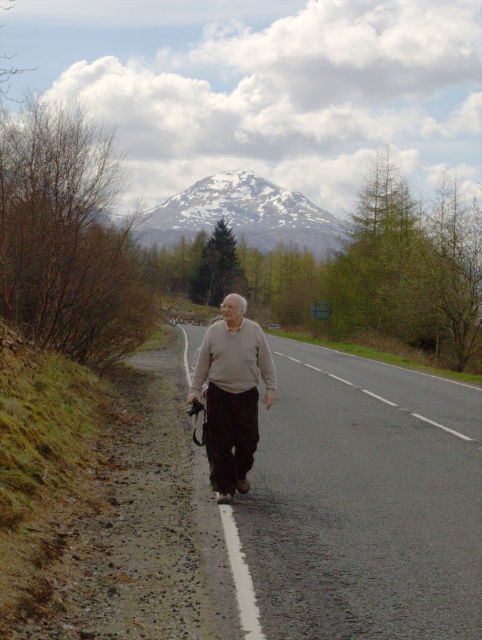
Does snowy peak at upper center appear on the left side of sweater at center?

Correct, you'll find snowy peak at upper center to the left of sweater at center.

Looking at this image, does snowy peak at upper center appear over sweater at center?

Correct, snowy peak at upper center is located above sweater at center.

From the picture: Who is more forward, (211, 200) or (228, 432)?

Point (228, 432) is more forward.

Identify the location of snowy peak at upper center. This screenshot has height=640, width=482. (241, 212).